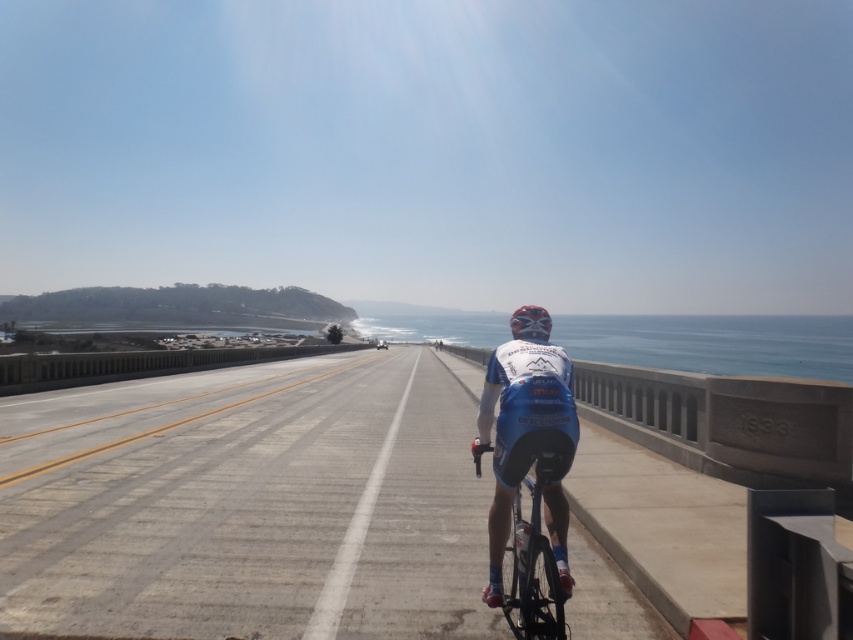
You are a cyclist planning to ride along the two lanes of the road shown. The point at coordinates (248, 506) marks the gray asphalt highway at center. If you want to stay on the gray asphalt highway at center, which lane should you choose between the two lanes?

The point at coordinates (248, 506) indicates the gray asphalt highway at center, so to stay on it, you should choose the right lane as the cyclist is already riding on the right lane which aligns with the center highway marked by the point.

Consider the image. You are a GPS navigator and need to guide a driver to stay on the gray asphalt highway at center. What coordinates should the driver aim for to stay on the correct path?

The driver should aim for the coordinates point (248,506) to stay on the gray asphalt highway at center.

You are a photographer positioned at the center of the road. You want to take a photo of the blue fabric jersey at center. Where should you aim your camera to capture the jersey in the photo?

You should aim your camera at point (526, 442) to capture the blue fabric jersey at center in the photo.